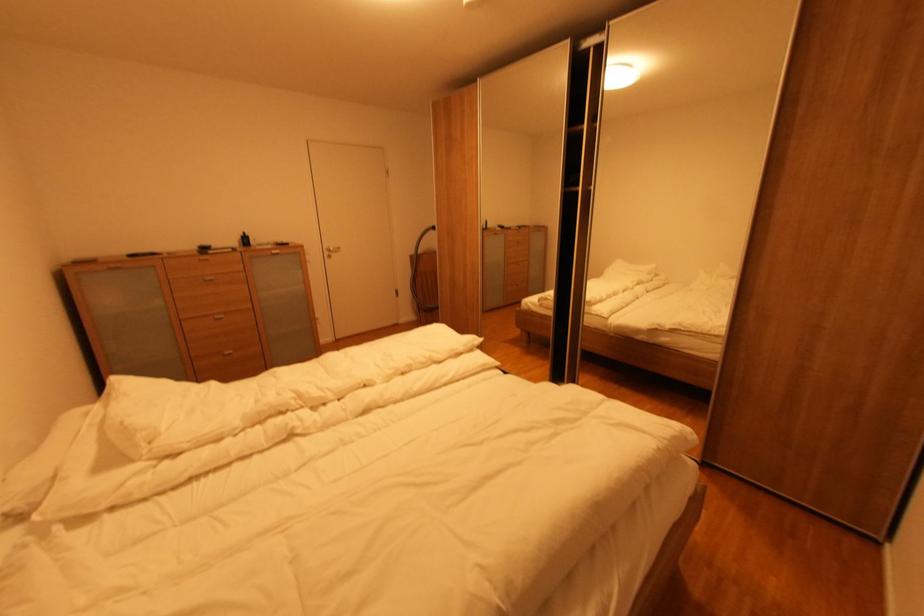
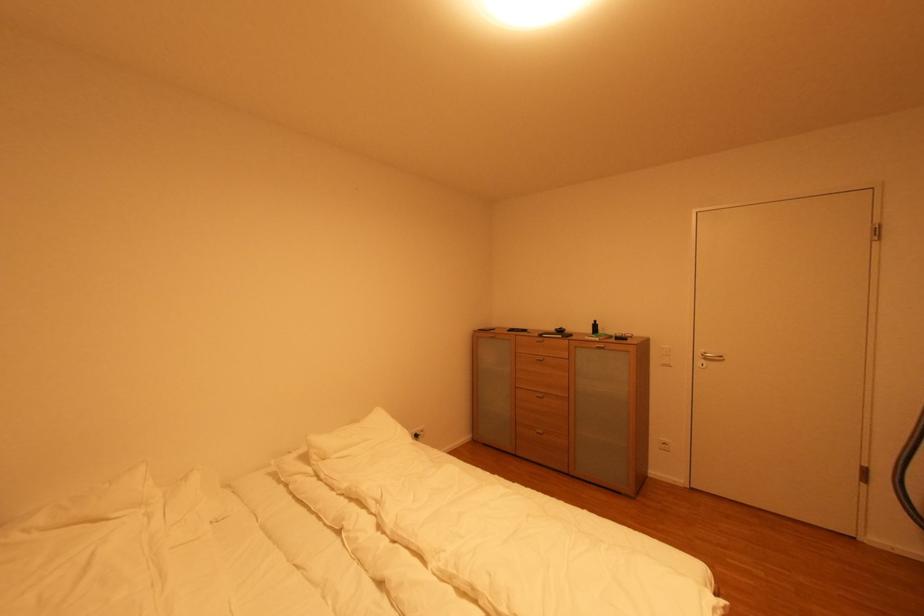
Where in the second image is the point corresponding to (x=155, y=444) from the first image?

(330, 461)